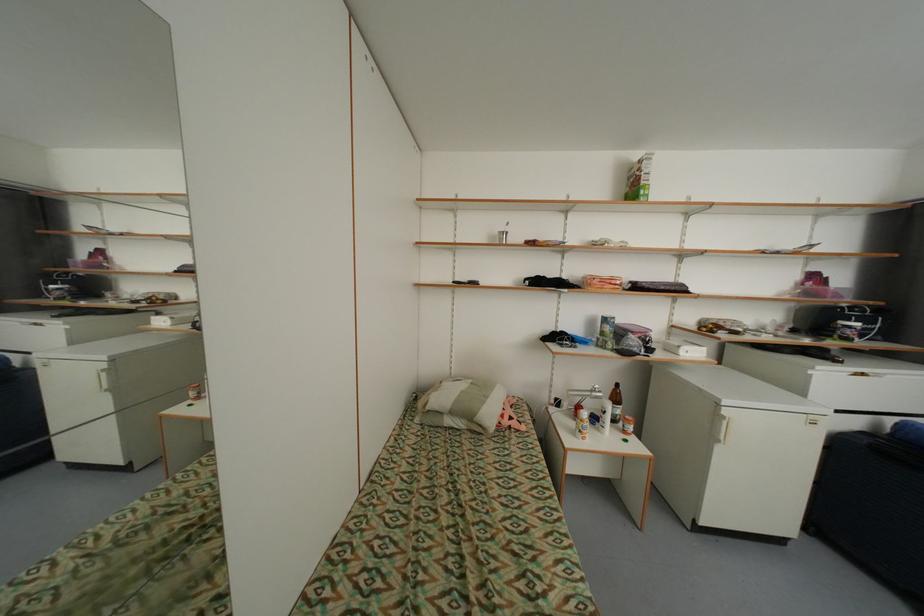
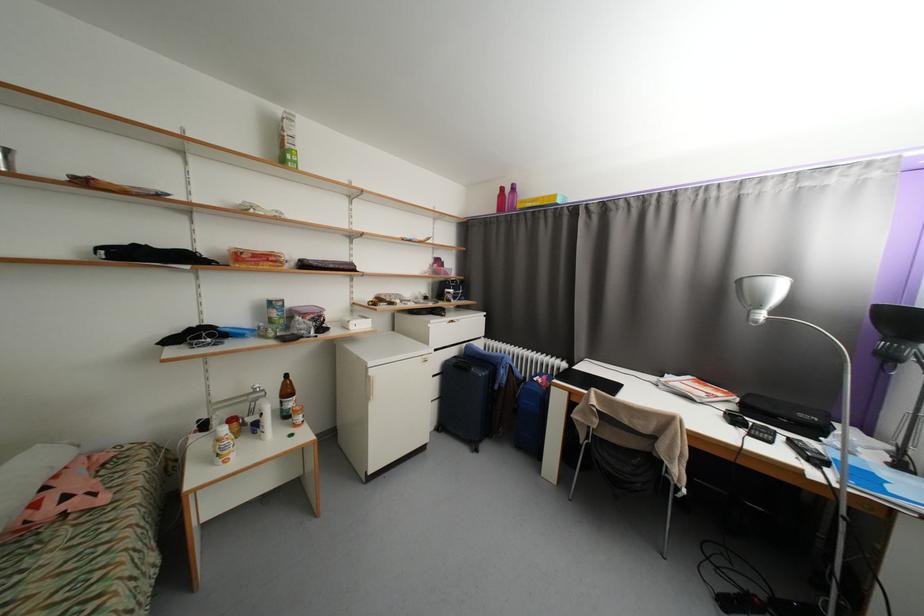
In the second image, find the point that corresponds to point (570, 406) in the first image.

(222, 424)